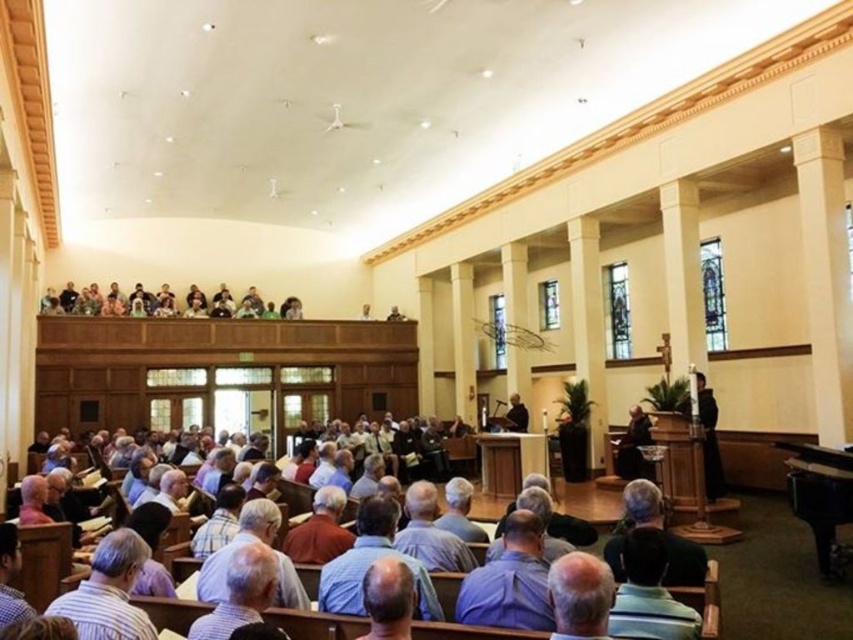
You are standing at the back of the church and want to walk to the front. Which object will you pass first, the light brown wooden pews at lower center or the black smooth pulpit at center?

You will pass the black smooth pulpit at center first because the light brown wooden pews at lower center is positioned over it, meaning the pulpit is closer to the front and you would reach it before the pews.

You are an event planner arranging chairs for a presentation. You need to place a chair that is 1.2 meters wide between the light brown wooden pews at lower center and the black smooth pulpit at center. Can the chair fit in the space between them?

The light brown wooden pews at lower center has a lesser width compared to black smooth pulpit at center. Since the pews are narrower than the pulpit, the space between them might be sufficient. However, without exact measurements of the gap, it is uncertain if the 1.2 meter wide chair will fit. Check the actual space before placing the chair.

You are standing at the back of the church and want to see the black smooth pulpit at center. Are the light brown wooden pews at lower center blocking your view?

The light brown wooden pews at lower center are shorter than the black smooth pulpit at center, so they won